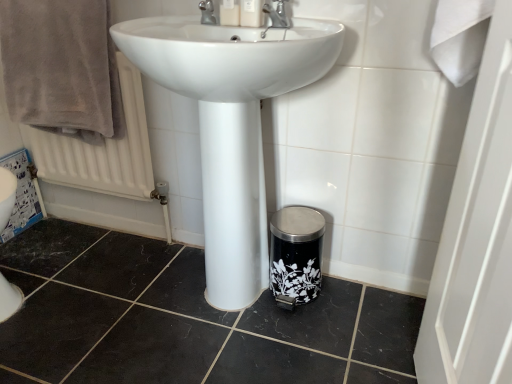
I want to click on vacant area that lies in front of white textured radiator at upper left, so click(86, 277).